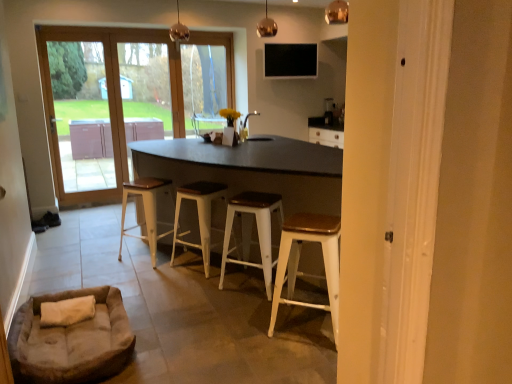
Question: Relative to suede beige dog bed at lower left, is wooden door at left in front or behind?

Choices:
 (A) front
 (B) behind

Answer: (B)

Question: Considering the positions of wooden door at left and suede beige dog bed at lower left in the image, is wooden door at left wider or thinner than suede beige dog bed at lower left?

Choices:
 (A) wide
 (B) thin

Answer: (B)

Question: Estimate the real-world distances between objects in this image. Which object is closer to the wooden door at left?

Choices:
 (A) wooden seat white stool at center, the 4th stool when ordered from right to left
 (B) wooden seat white metal stool at center, marked as the third stool in a left-to-right arrangement
 (C) white wood stool at center, positioned as the third stool in right-to-left order
 (D) white metal stool at lower right, which is the 1th stool from right to left
 (E) suede beige dog bed at lower left

Answer: (A)

Question: Which object is the farthest from the white wood stool at center, the 2th stool in the left-to-right sequence?

Choices:
 (A) wooden door at left
 (B) white metal stool at lower right, the fourth stool positioned from the left
 (C) matte black sink at center
 (D) wooden seat white stool at center, the first stool from the left
 (E) black matte tv at upper center

Answer: (E)